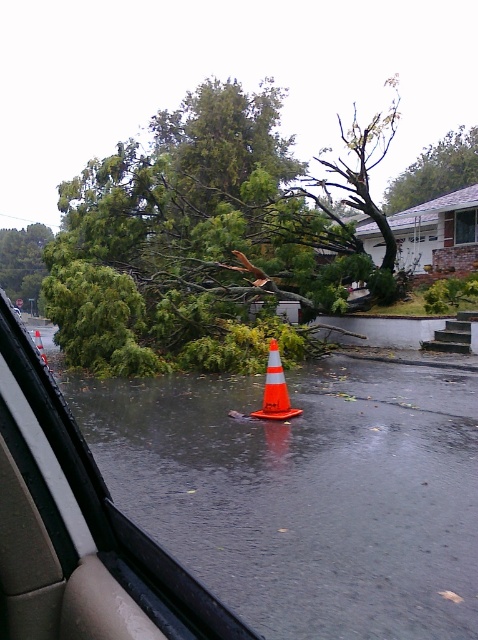
You are a pedestrian trying to cross the street and see the wet asphalt flood at lower center and the green leafy tree at upper center. Which object is closer to you?

The wet asphalt flood at lower center is closer to the viewer than the green leafy tree at upper center.

Looking at this image, you are a pedestrian trying to cross the street where the fallen tree is located. You see the green leafy tree at upper center and the orange reflective cone at center. Which object is higher up in the image?

The green leafy tree at upper center is above the orange reflective cone at center, so it is higher up in the image.